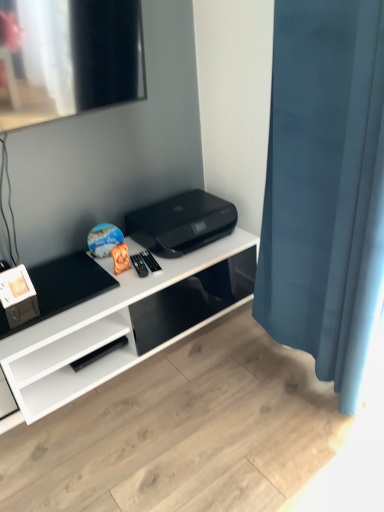
Where is `empty space that is ontop of white glossy desk at center`? The width and height of the screenshot is (384, 512). empty space that is ontop of white glossy desk at center is located at coordinates (104, 294).